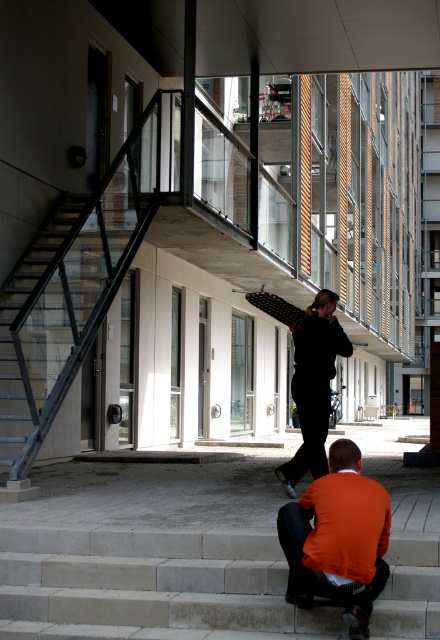
Between concrete steps at lower center and black matte pants at center, which one is positioned lower?

concrete steps at lower center

Can you confirm if concrete steps at lower center is taller than black matte pants at center?

Incorrect, concrete steps at lower center's height is not larger of black matte pants at center's.

Who is more distant from viewer, (x=29, y=576) or (x=294, y=378)?

The point (x=294, y=378) is more distant.

In order to click on concrete steps at lower center in this screenshot , I will do `click(149, 586)`.

Does concrete steps at lower center have a lesser width compared to orange sweater at lower center?

Incorrect, concrete steps at lower center's width is not less than orange sweater at lower center's.

Is concrete steps at lower center smaller than orange sweater at lower center?

No.

In order to click on concrete steps at lower center in this screenshot , I will do `click(149, 586)`.

Find the location of a particular element. concrete steps at lower center is located at coordinates (149, 586).

Can you confirm if orange sweater at lower center is wider than black matte pants at center?

No, orange sweater at lower center is not wider than black matte pants at center.

Based on the photo, how much distance is there between orange sweater at lower center and black matte pants at center?

2.11 meters

Between point (308, 545) and point (325, 310), which one is positioned behind?

The point (325, 310) is more distant.

Where is `orange sweater at lower center`? The height and width of the screenshot is (640, 440). orange sweater at lower center is located at coordinates 337,538.